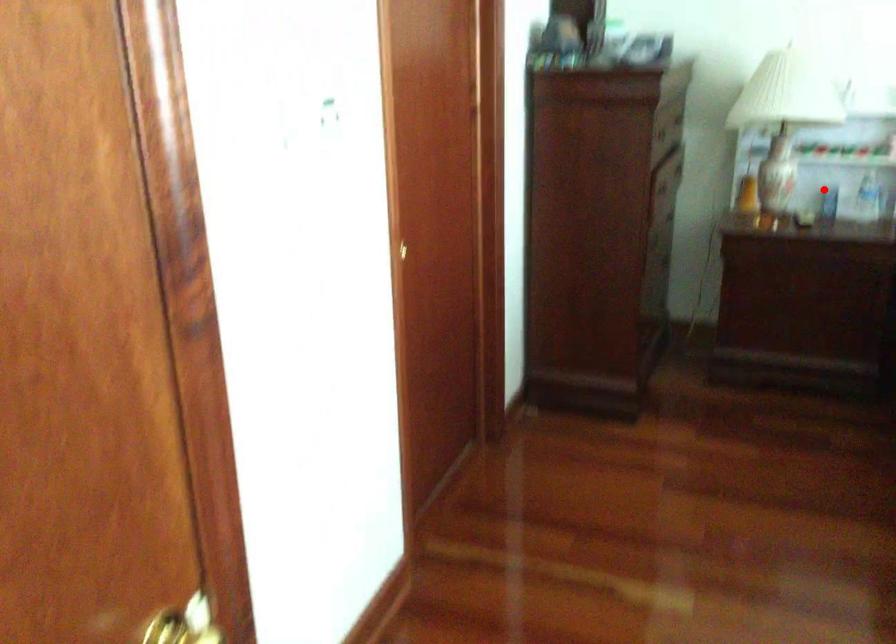
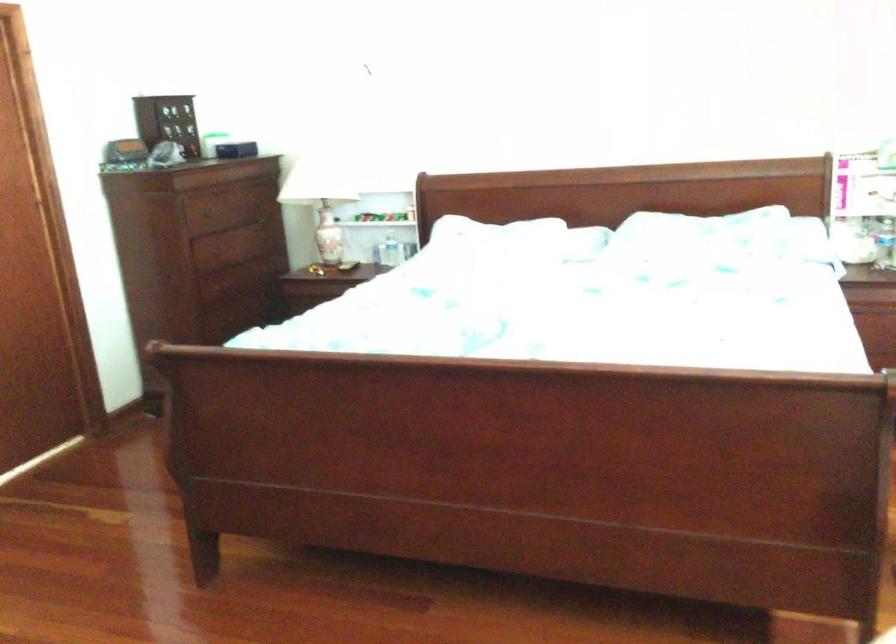
Find the pixel in the second image that matches the highlighted location in the first image.

(390, 251)